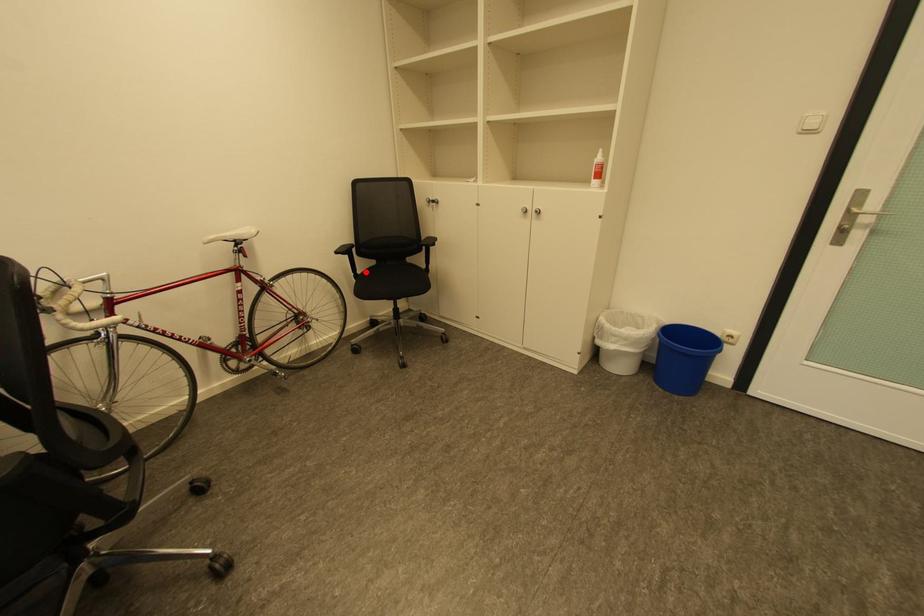
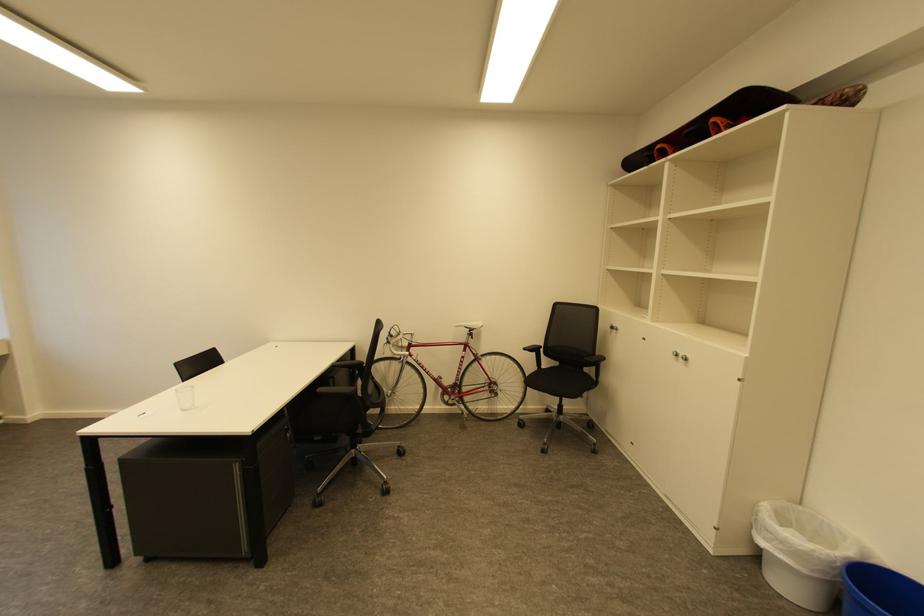
Question: I am providing you with two images of the same scene from different viewpoints. In image1, a red point is highlighted. Considering the same 3D point in image2, which of the following is correct?

Choices:
 (A) It is closer
 (B) It is farther

Answer: (B)